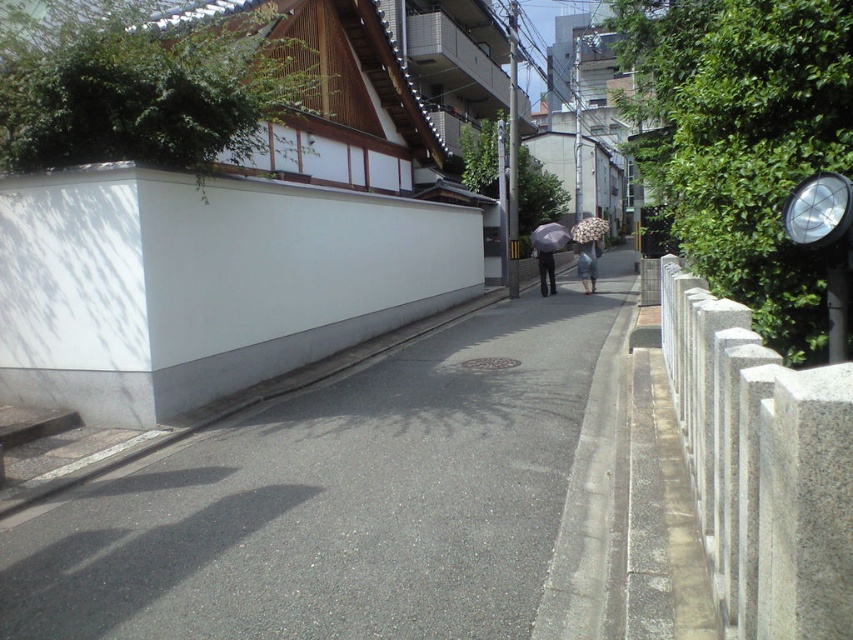
Question: Which object is farther from the camera taking this photo?

Choices:
 (A) transparent plastic umbrella at center
 (B) dark gray pants at center
 (C) gray asphalt pavement at center

Answer: (A)

Question: Which of the following is the farthest from the observer?

Choices:
 (A) (561, 248)
 (B) (547, 291)
 (C) (428, 636)

Answer: (A)

Question: Can you confirm if transparent plastic umbrella at center is bigger than dark gray pants at center?

Choices:
 (A) yes
 (B) no

Answer: (A)

Question: Is transparent fabric umbrella at center above transparent plastic umbrella at center?

Choices:
 (A) yes
 (B) no

Answer: (B)

Question: Among these objects, which one is farthest from the camera?

Choices:
 (A) transparent plastic umbrella at center
 (B) transparent fabric umbrella at center
 (C) dark gray pants at center

Answer: (A)

Question: Does gray asphalt pavement at center have a lesser width compared to transparent plastic umbrella at center?

Choices:
 (A) no
 (B) yes

Answer: (B)